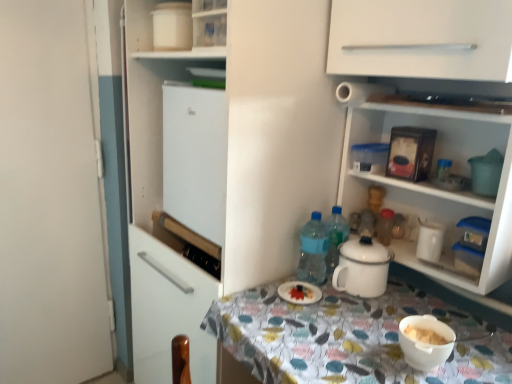
Question: From a real-world perspective, is white enamel pot at center below white glossy plate at center?

Choices:
 (A) yes
 (B) no

Answer: (B)

Question: Is white enamel pot at center directly adjacent to white glossy plate at center?

Choices:
 (A) yes
 (B) no

Answer: (B)

Question: Is white enamel pot at center at the right side of white glossy plate at center?

Choices:
 (A) no
 (B) yes

Answer: (B)

Question: Considering the relative sizes of white enamel pot at center and white glossy plate at center in the image provided, is white enamel pot at center bigger than white glossy plate at center?

Choices:
 (A) yes
 (B) no

Answer: (A)

Question: Can you confirm if white enamel pot at center is positioned to the left of white glossy plate at center?

Choices:
 (A) yes
 (B) no

Answer: (B)

Question: Can you confirm if white enamel pot at center is smaller than white glossy plate at center?

Choices:
 (A) yes
 (B) no

Answer: (B)

Question: Is white glossy shelves at upper right oriented away from white glossy plate at center?

Choices:
 (A) no
 (B) yes

Answer: (A)

Question: Considering the relative sizes of white glossy shelves at upper right and white glossy plate at center in the image provided, is white glossy shelves at upper right bigger than white glossy plate at center?

Choices:
 (A) no
 (B) yes

Answer: (B)

Question: Does white glossy shelves at upper right lie in front of white glossy plate at center?

Choices:
 (A) yes
 (B) no

Answer: (A)

Question: Is white glossy shelves at upper right thinner than white glossy plate at center?

Choices:
 (A) no
 (B) yes

Answer: (A)

Question: From the image's perspective, would you say white glossy shelves at upper right is shown under white glossy plate at center?

Choices:
 (A) no
 (B) yes

Answer: (A)

Question: Is white glossy shelves at upper right to the right of white glossy plate at center from the viewer's perspective?

Choices:
 (A) no
 (B) yes

Answer: (B)

Question: Does white matte door at left have a greater width compared to white glossy plate at center?

Choices:
 (A) no
 (B) yes

Answer: (A)